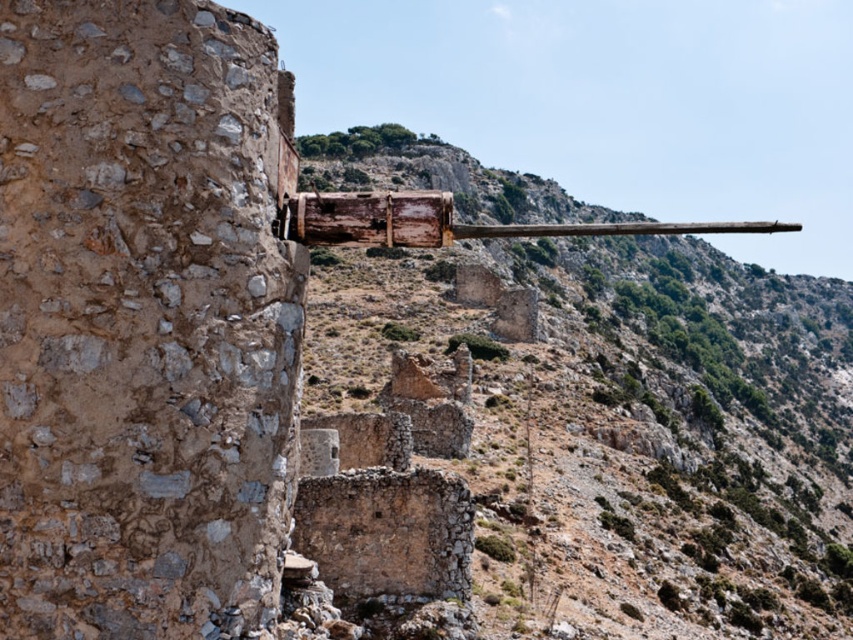
Does rustic stone wall at left appear on the left side of rusty wood cannon at center?

Correct, you'll find rustic stone wall at left to the left of rusty wood cannon at center.

Which is below, rustic stone wall at left or rusty wood cannon at center?

rustic stone wall at left

What do you see at coordinates (142, 321) in the screenshot? I see `rustic stone wall at left` at bounding box center [142, 321].

This screenshot has height=640, width=853. I want to click on rustic stone wall at left, so click(x=142, y=321).